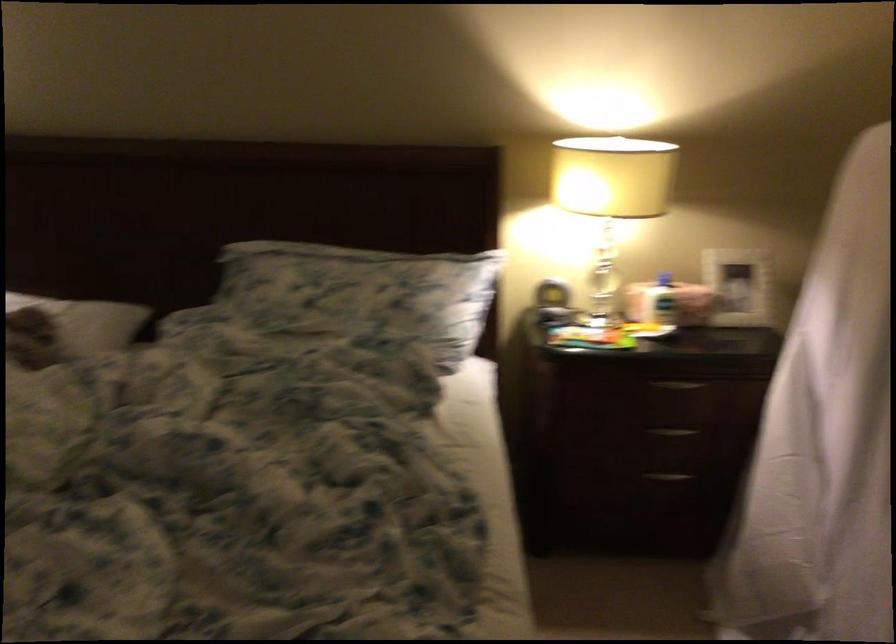
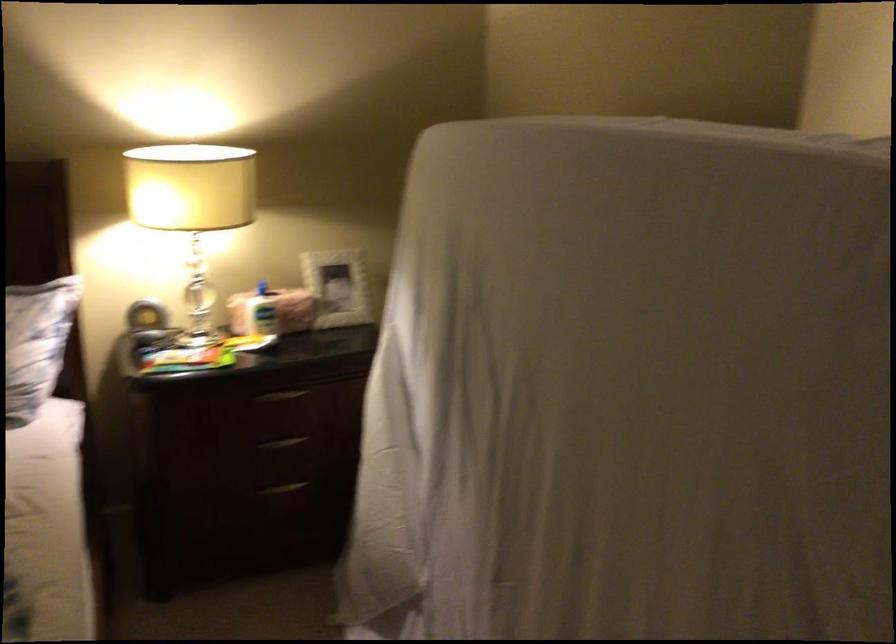
In the second image, find the point that corresponds to [679,297] in the first image.

(273, 310)